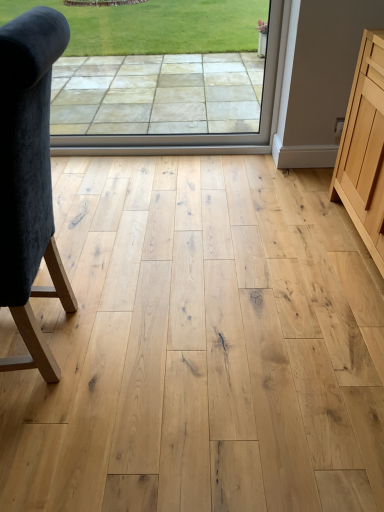
Locate an element on the screen. Image resolution: width=384 pixels, height=512 pixels. transparent glass window at center is located at coordinates (142, 92).

Where is `velvet dark blue chair at left`? This screenshot has height=512, width=384. velvet dark blue chair at left is located at coordinates (29, 179).

Locate an element on the screen. The height and width of the screenshot is (512, 384). cabinetry directly beneath the velvet dark blue chair at left (from a real-world perspective) is located at coordinates pyautogui.click(x=364, y=149).

Does point (35, 151) appear closer or farther from the camera than point (359, 169)?

Point (35, 151) is closer to the camera than point (359, 169).

Between velvet dark blue chair at left and natural wood cabinet at right, which one has larger size?

natural wood cabinet at right is bigger.

How different are the orientations of velvet dark blue chair at left and natural wood cabinet at right in degrees?

velvet dark blue chair at left and natural wood cabinet at right are facing 2.9 degrees away from each other.

In order to click on chair that is below the natural wood cabinet at right (from the image's perspective) in this screenshot , I will do `click(29, 179)`.

What's the angular difference between natural wood cabinet at right and velvet dark blue chair at left's facing directions?

The angular difference between natural wood cabinet at right and velvet dark blue chair at left is 2.9 degrees.

Considering the sizes of objects natural wood cabinet at right and velvet dark blue chair at left in the image provided, who is bigger, natural wood cabinet at right or velvet dark blue chair at left?

With larger size is natural wood cabinet at right.

Consider the image. From the image's perspective, is natural wood cabinet at right on velvet dark blue chair at left?

Yes, from the image's perspective, natural wood cabinet at right is over velvet dark blue chair at left.

Which object is further away from the camera taking this photo, transparent glass window at center or natural wood cabinet at right?

transparent glass window at center is further away from the camera.

Is transparent glass window at center far away from natural wood cabinet at right?

Yes, transparent glass window at center is far from natural wood cabinet at right.

Does transparent glass window at center have a smaller size compared to natural wood cabinet at right?

Indeed, transparent glass window at center has a smaller size compared to natural wood cabinet at right.

Does transparent glass window at center turn towards velvet dark blue chair at left?

Yes, transparent glass window at center is turned towards velvet dark blue chair at left.

Is transparent glass window at center thinner than velvet dark blue chair at left?

Yes, transparent glass window at center is thinner than velvet dark blue chair at left.

From the picture: Is transparent glass window at center at the left side of velvet dark blue chair at left?

No.

Is velvet dark blue chair at left situated inside transparent glass window at center or outside?

The correct answer is: outside.

Is velvet dark blue chair at left taller than transparent glass window at center?

Yes, velvet dark blue chair at left is taller than transparent glass window at center.

Where is `chair below the transparent glass window at center (from the image's perspective)`? The height and width of the screenshot is (512, 384). chair below the transparent glass window at center (from the image's perspective) is located at coordinates (29, 179).

Is transparent glass window at center at the back of velvet dark blue chair at left?

No, velvet dark blue chair at left is not facing the opposite direction of transparent glass window at center.

Consider the image. Between natural wood cabinet at right and transparent glass window at center, which one has more height?

transparent glass window at center is taller.

Is point (354, 147) more distant than point (125, 102)?

No, (354, 147) is closer to viewer.

Could transparent glass window at center be considered to be inside natural wood cabinet at right?

No, transparent glass window at center is not a part of natural wood cabinet at right.

Is natural wood cabinet at right to the left of transparent glass window at center from the viewer's perspective?

No, natural wood cabinet at right is not to the left of transparent glass window at center.

Identify the location of chair that is in front of the natural wood cabinet at right. Image resolution: width=384 pixels, height=512 pixels. (29, 179).

Identify the location of chair on the left of natural wood cabinet at right. The height and width of the screenshot is (512, 384). (29, 179).

Considering their positions, is transparent glass window at center positioned further to natural wood cabinet at right than velvet dark blue chair at left?

velvet dark blue chair at left lies further to natural wood cabinet at right than the other object.

Estimate the real-world distances between objects in this image. Which object is closer to natural wood cabinet at right, velvet dark blue chair at left or transparent glass window at center?

Among the two, transparent glass window at center is located nearer to natural wood cabinet at right.

Looking at the image, which one is located closer to transparent glass window at center, natural wood cabinet at right or velvet dark blue chair at left?

natural wood cabinet at right is positioned closer to the anchor transparent glass window at center.

Based on the photo, when comparing their distances from velvet dark blue chair at left, does natural wood cabinet at right or transparent glass window at center seem further?

transparent glass window at center is positioned further to the anchor velvet dark blue chair at left.

When comparing their distances from transparent glass window at center, does velvet dark blue chair at left or natural wood cabinet at right seem closer?

natural wood cabinet at right is closer to transparent glass window at center.

From the image, which object appears to be nearer to velvet dark blue chair at left, transparent glass window at center or natural wood cabinet at right?

natural wood cabinet at right lies closer to velvet dark blue chair at left than the other object.

Locate an element on the screen. cabinetry positioned between velvet dark blue chair at left and transparent glass window at center from near to far is located at coordinates (364, 149).